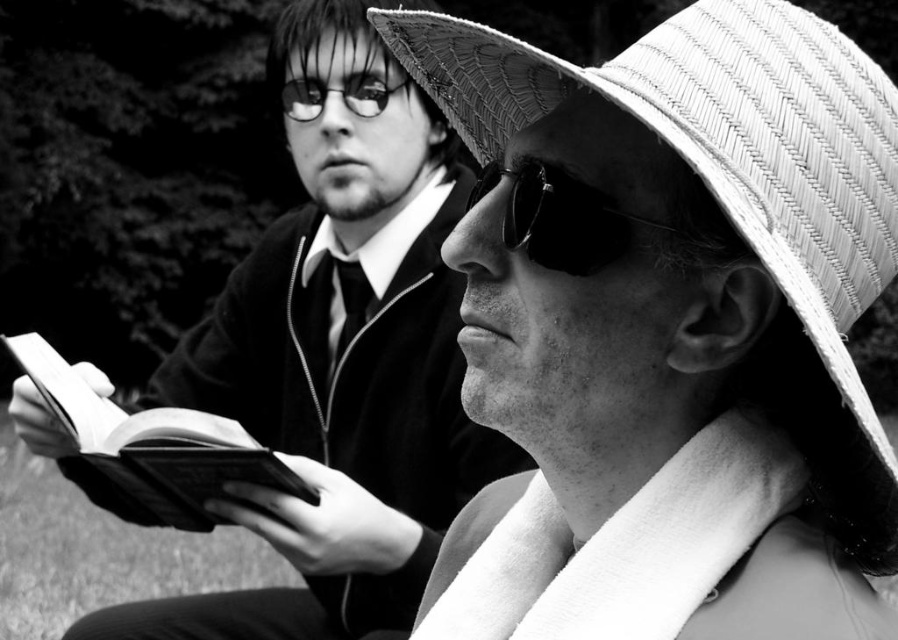
Measure the distance from hardcover book at left to sunglasses at center.

1.31 meters

Does point (236, 426) come in front of point (516, 164)?

No, it is not.

Is point (208, 515) closer to viewer compared to point (562, 252)?

No.

The width and height of the screenshot is (898, 640). In order to click on hardcover book at left in this screenshot , I will do `click(153, 444)`.

Is point (150, 426) positioned before point (355, 86)?

Yes, point (150, 426) is closer to viewer.

Who is taller, hardcover book at left or matte black glasses at upper center?

With more height is hardcover book at left.

Locate an element on the screen. hardcover book at left is located at coordinates (153, 444).

Consider the image. Which is below, woven straw hat at upper right or hardcover book at left?

hardcover book at left is below.

Who is higher up, woven straw hat at upper right or hardcover book at left?

woven straw hat at upper right is above.

Which is in front, point (659, 58) or point (131, 458)?

Point (659, 58) is more forward.

Find the location of `woven straw hat at upper right`. woven straw hat at upper right is located at coordinates (734, 177).